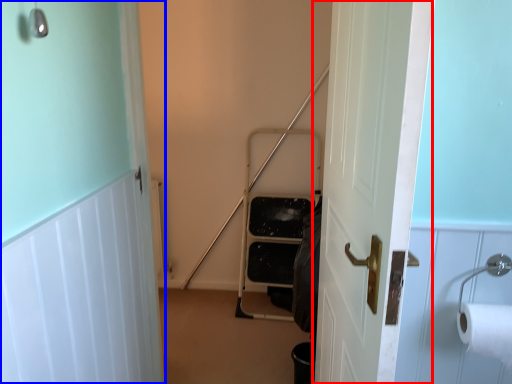
Question: Among these objects, which one is nearest to the camera, door (highlighted by a red box) or door (highlighted by a blue box)?

Choices:
 (A) door
 (B) door

Answer: (A)